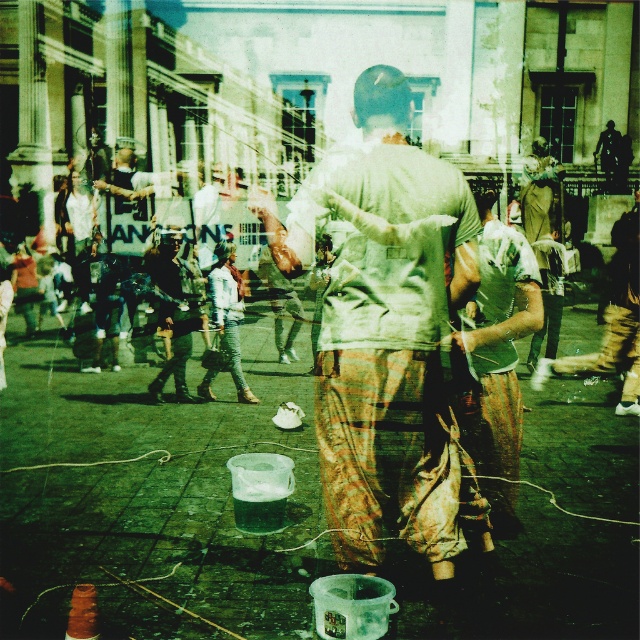
Question: Which object is closer to the camera taking this photo?

Choices:
 (A) light gray cotton shirt at center
 (B) green fabric shirt at center
 (C) camouflage fabric shirt at center

Answer: (A)

Question: Can you confirm if green fabric shirt at center is thinner than camouflage fabric shirt at center?

Choices:
 (A) yes
 (B) no

Answer: (A)

Question: Which point is closer to the camera taking this photo?

Choices:
 (A) (476, 374)
 (B) (160, 298)
 (C) (417, 161)

Answer: (C)

Question: Is light gray cotton shirt at center to the right of camouflage fabric shirt at center from the viewer's perspective?

Choices:
 (A) yes
 (B) no

Answer: (A)

Question: Can you confirm if light gray cotton shirt at center is thinner than camouflage fabric shirt at center?

Choices:
 (A) no
 (B) yes

Answer: (A)

Question: Considering the real-world distances, which object is closest to the light gray cotton shirt at center?

Choices:
 (A) camouflage fabric shirt at center
 (B) green fabric shirt at center

Answer: (B)